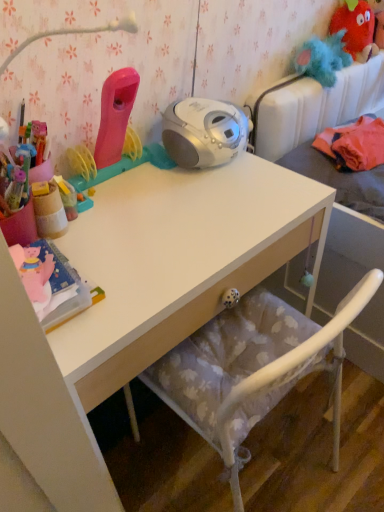
Question: Is fuzzy red monster at upper right in front of or behind white matte desk at center in the image?

Choices:
 (A) behind
 (B) front

Answer: (A)

Question: Is fuzzy red monster at upper right wider or thinner than white matte desk at center?

Choices:
 (A) thin
 (B) wide

Answer: (A)

Question: Which of these objects is positioned farthest from the wooden pencil case at left?

Choices:
 (A) fluffy fabric bed at upper right
 (B) white matte desk at center
 (C) fuzzy red monster at upper right

Answer: (C)

Question: Which is nearer to the wooden pencil case at left?

Choices:
 (A) fluffy fabric bed at upper right
 (B) fuzzy red monster at upper right
 (C) white matte desk at center

Answer: (C)